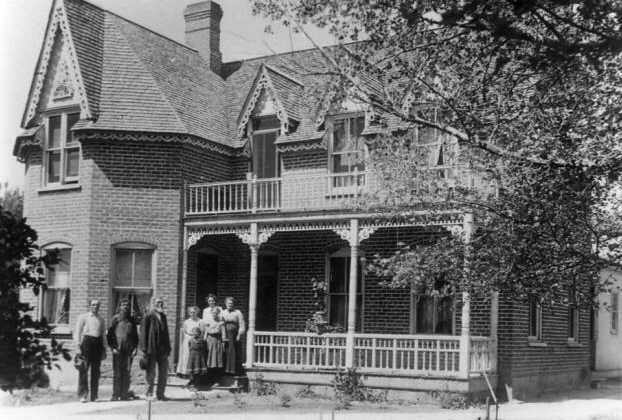
Find the location of a particular element. The image size is (622, 420). windows is located at coordinates (71, 142), (50, 287), (134, 288), (265, 146), (350, 144), (446, 317), (341, 274), (540, 331), (583, 331).